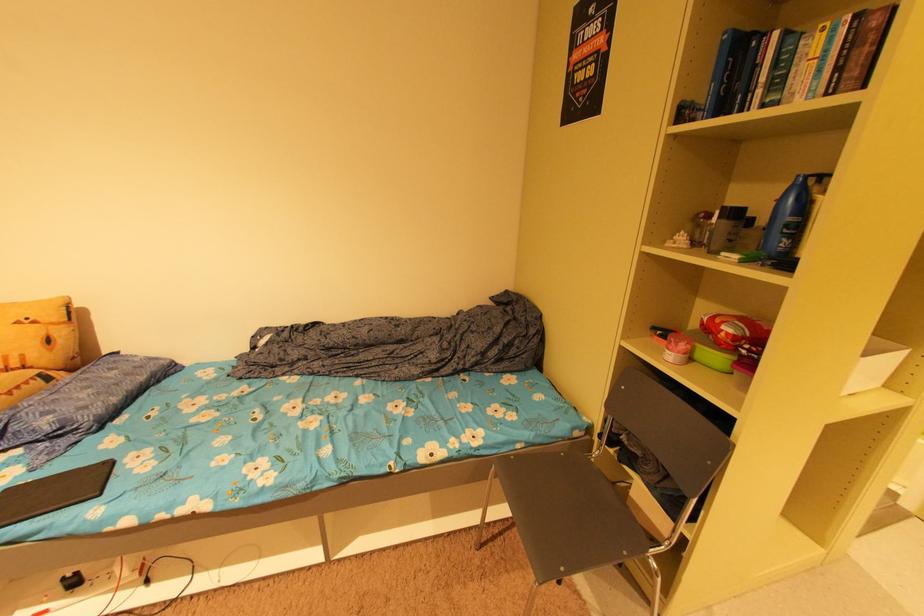
Find the location of a particular element. Image resolution: width=924 pixels, height=616 pixels. yellow patterned pillow is located at coordinates (35, 346).